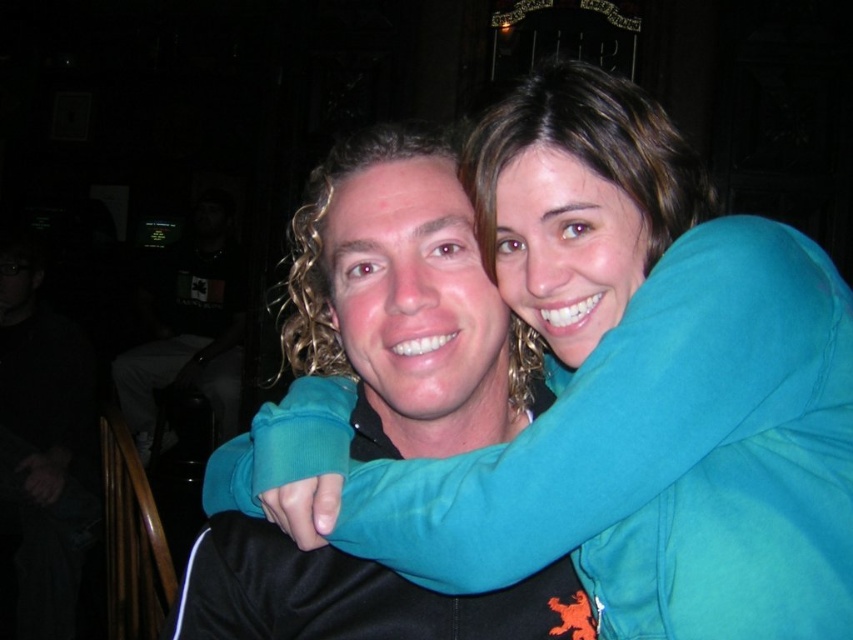
You are a photographer trying to capture the teal fleece jacket at center and the matte teal hoodie at center in a photo. Which one is located to the right of the other?

The teal fleece jacket at center is positioned on the right side of matte teal hoodie at center.

You are a photographer adjusting your camera settings to focus on the teal fleece jacket at center and the matte teal hoodie at center. Which one should you focus on first to ensure both are in sharp focus?

The teal fleece jacket at center is closer to the viewer than the matte teal hoodie at center, so you should focus on the teal fleece jacket at center first to ensure both are in sharp focus.

You are trying to decide which item to take from the two teal items at center. The teal fleece jacket at center and the matte teal hoodie at center. You need something that covers more of your body. Which one should you choose?

The teal fleece jacket at center is wider than the matte teal hoodie at center, so it covers more of your body and is the better choice.